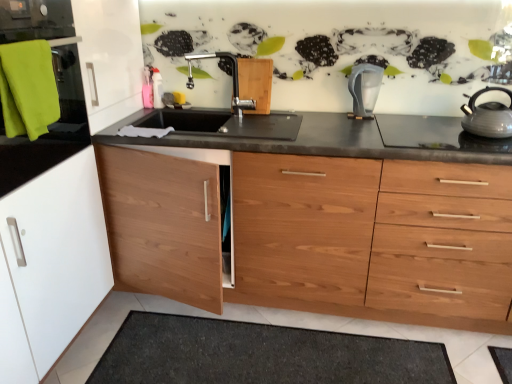
Find the location of a particular element. free space in front of metallic gray kettle at right is located at coordinates (487, 142).